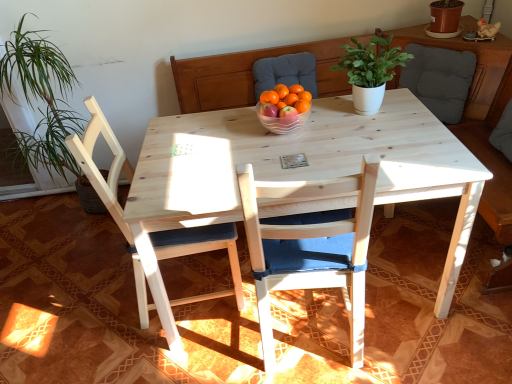
Question: In the image, is white matte plant pot at center on the left side or the right side of orange matte at center?

Choices:
 (A) left
 (B) right

Answer: (B)

Question: From the image's perspective, is white matte plant pot at center above or below orange matte at center?

Choices:
 (A) below
 (B) above

Answer: (B)

Question: Which object is the farthest from the natural wood chair at left, positioned as the first chair in left-to-right order?

Choices:
 (A) orange matte at center, which is the first tangerine in left-to-right order
 (B) dark gray fabric cushion at upper right
 (C) orange matte at center, arranged as the 1th tangerine when viewed from the right
 (D) white matte plant pot at center
 (E) orange matte at center

Answer: (B)

Question: Which object is the farthest from the clear plastic bowl at center?

Choices:
 (A) orange matte at center, which is the 2th tangerine from right to left
 (B) dark gray fabric cushion at upper right
 (C) orange matte at center
 (D) natural wood chair at left, positioned as the first chair in left-to-right order
 (E) orange matte at center, the 2th tangerine when ordered from left to right

Answer: (B)